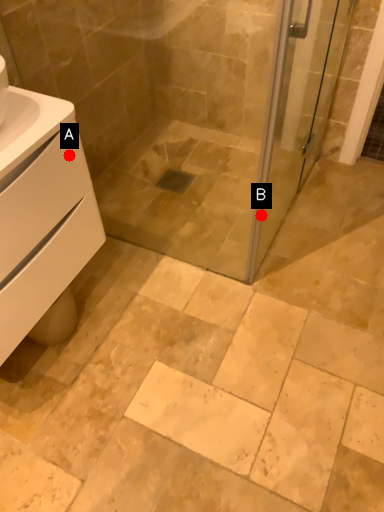
Question: Two points are circled on the image, labeled by A and B beside each circle. Which point appears closest to the camera in this image?

Choices:
 (A) A is closer
 (B) B is closer

Answer: (A)